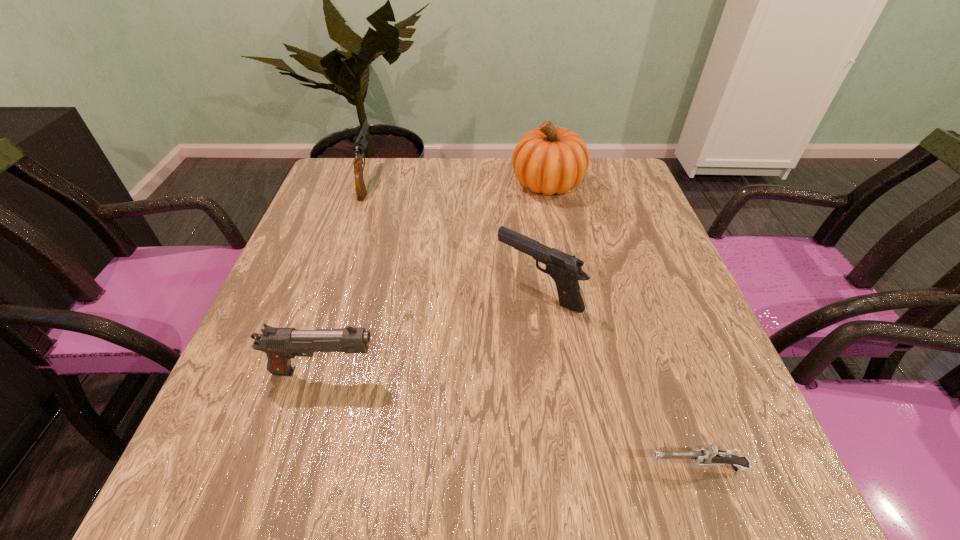
The image size is (960, 540). Find the location of `the tallest object`. the tallest object is located at coordinates (549, 160).

Locate an element on the screen. Image resolution: width=960 pixels, height=540 pixels. the farthest gun is located at coordinates (360, 145).

Locate an element on the screen. This screenshot has width=960, height=540. the third nearest object is located at coordinates (564, 269).

Find the location of a particular element. the third gun from left to right is located at coordinates (564, 269).

In order to click on the second nearest gun in this screenshot , I will do `click(280, 344)`.

This screenshot has width=960, height=540. Identify the location of the shortest gun. (710, 455).

Where is `the rightmost gun`? The height and width of the screenshot is (540, 960). the rightmost gun is located at coordinates (710, 455).

This screenshot has height=540, width=960. In order to click on free space located 0.380m on the left of the tallest object in this screenshot , I will do `click(376, 183)`.

Where is `vacant space positioned at the muzzle of the second farthest gun`? vacant space positioned at the muzzle of the second farthest gun is located at coordinates (327, 291).

The height and width of the screenshot is (540, 960). Find the location of `free space located at the muzzle of the second farthest gun`. free space located at the muzzle of the second farthest gun is located at coordinates (313, 291).